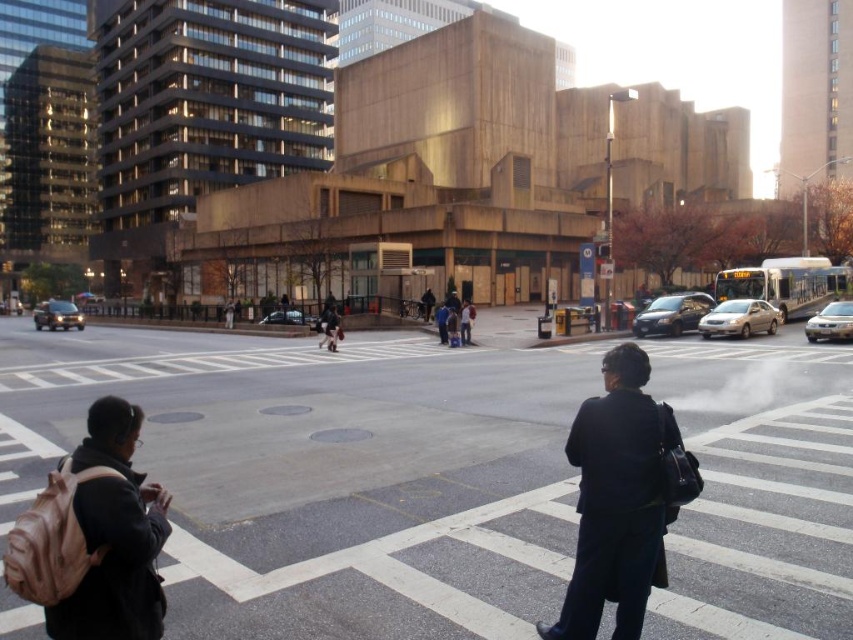
Can you confirm if dark gray asphalt at center is positioned above beige fabric backpack at lower left?

Incorrect, dark gray asphalt at center is not positioned above beige fabric backpack at lower left.

Which is above, dark gray asphalt at center or beige fabric backpack at lower left?

beige fabric backpack at lower left is above.

Image resolution: width=853 pixels, height=640 pixels. I want to click on dark gray asphalt at center, so tap(323, 474).

Does dark gray asphalt at center have a greater height compared to dark blue coat at center?

No.

Looking at this image, how distant is dark gray asphalt at center from dark blue coat at center?

dark gray asphalt at center is 11.77 meters from dark blue coat at center.

Is point (480, 493) positioned before point (633, 369)?

No, it is behind (633, 369).

The height and width of the screenshot is (640, 853). Find the location of `dark gray asphalt at center`. dark gray asphalt at center is located at coordinates (323, 474).

Measure the distance between point (577, 532) and camera.

Point (577, 532) and camera are 6.41 meters apart.

From the picture: Is dark blue coat at center thinner than beige fabric backpack at lower left?

No.

Measure the distance between point (575, 632) and camera.

Point (575, 632) is 4.06 meters away from camera.

This screenshot has height=640, width=853. I want to click on dark blue coat at center, so click(x=618, y=500).